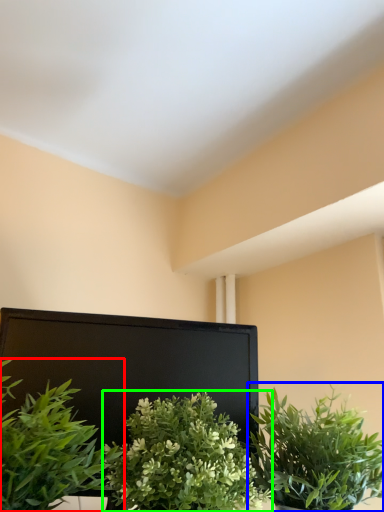
Question: Estimate the real-world distances between objects in this image. Which object is closer to houseplant (highlighted by a red box), houseplant (highlighted by a blue box) or houseplant (highlighted by a green box)?

Choices:
 (A) houseplant
 (B) houseplant

Answer: (B)